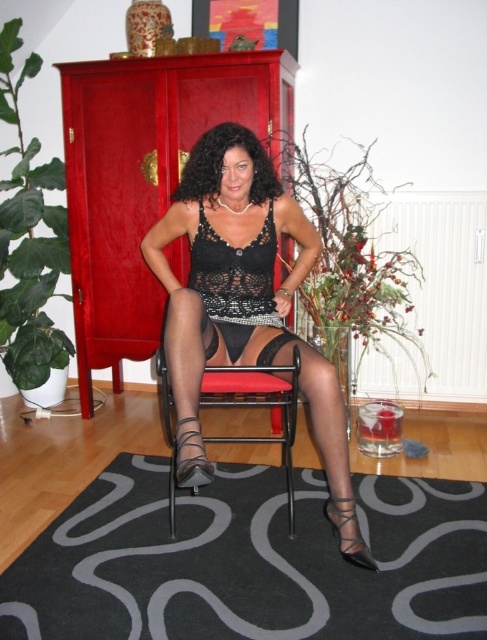
Question: Can you confirm if red wood armoire at left is positioned to the left of black sheer stocking at lower center?

Choices:
 (A) no
 (B) yes

Answer: (B)

Question: Which of the following is the farthest from the observer?

Choices:
 (A) black lace dress at center
 (B) black sheer stocking at lower center
 (C) black lace lingerie at center

Answer: (A)

Question: Which point appears farthest from the camera in this image?

Choices:
 (A) (207, 212)
 (B) (337, 518)

Answer: (A)

Question: Does red wood armoire at left lie behind black lace lingerie at center?

Choices:
 (A) no
 (B) yes

Answer: (B)

Question: Is red wood armoire at left bigger than black lace dress at center?

Choices:
 (A) no
 (B) yes

Answer: (B)

Question: Which point is farther to the camera?

Choices:
 (A) (255, 262)
 (B) (357, 545)
 (C) (80, 396)
 (D) (199, 179)

Answer: (C)